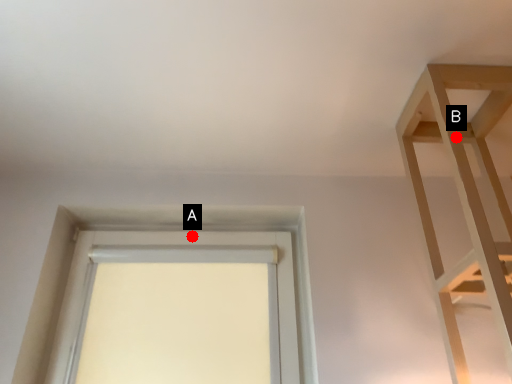
Question: Two points are circled on the image, labeled by A and B beside each circle. Which point is farther to the camera?

Choices:
 (A) A is further
 (B) B is further

Answer: (A)